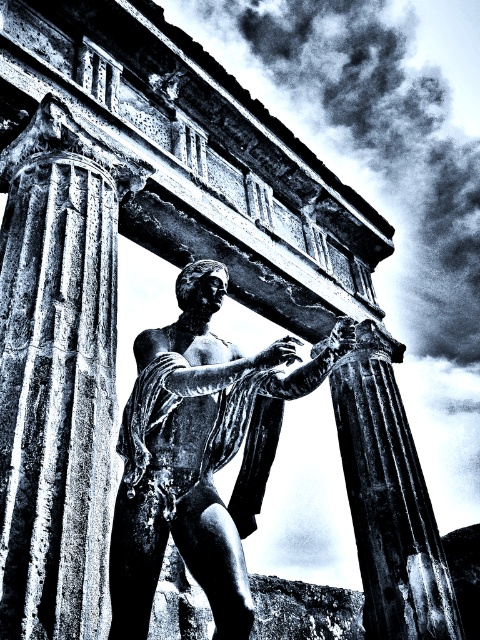
Can you confirm if polished bronze statue at center is positioned below smooth stone column at center?

Incorrect, polished bronze statue at center is not positioned below smooth stone column at center.

Who is higher up, polished bronze statue at center or smooth stone column at center?

polished bronze statue at center is above.

Is point (244, 433) farther from viewer compared to point (406, 481)?

No.

Locate an element on the screen. polished bronze statue at center is located at coordinates (200, 452).

Is point (83, 404) closer to viewer compared to point (407, 433)?

Yes, point (83, 404) is closer to viewer.

Does smooth stone column at left appear on the left side of smooth stone column at center?

Indeed, smooth stone column at left is positioned on the left side of smooth stone column at center.

Image resolution: width=480 pixels, height=640 pixels. Identify the location of smooth stone column at left. (57, 397).

Is smooth stone column at left closer to camera compared to polished bronze statue at center?

Yes, smooth stone column at left is closer to the viewer.

Can you confirm if smooth stone column at left is thinner than polished bronze statue at center?

Correct, smooth stone column at left's width is less than polished bronze statue at center's.

The image size is (480, 640). Describe the element at coordinates (57, 397) in the screenshot. I see `smooth stone column at left` at that location.

Locate an element on the screen. The width and height of the screenshot is (480, 640). smooth stone column at left is located at coordinates (57, 397).